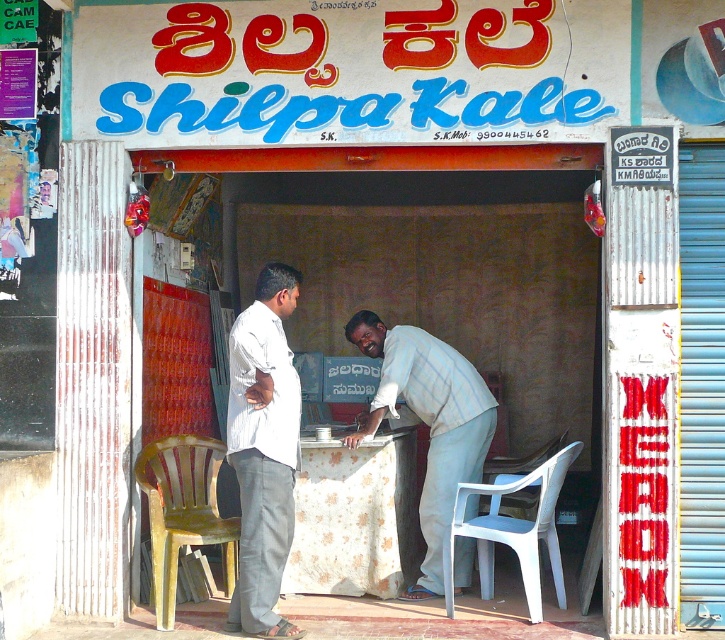
You are standing at the entrance of Shilpa Kale shop and want to reach the counter where the man is leaning over. The counter is located at point (538, 538). There is an obstacle at point (331, 467). Which point should you avoid to reach the counter safely?

You should avoid point (331, 467) because it is closer to you than the counter at point (538, 538), so navigating around it will ensure a safe path to the counter.

You are a customer entering the shop through the right door. You see the floral fabric tablecloth at center and the white plastic chair at lower right. Which object is closer to the entrance?

The white plastic chair at lower right is closer to the entrance because the floral fabric tablecloth at center is above it, indicating it is further back inside the shop.

Based on the photo, you are standing outside the shop entrance and want to place a new table exactly where the floral fabric tablecloth at center is currently located. Based on the coordinates provided, can you determine the exact position to place the table?

The floral fabric tablecloth at center is located at coordinates point (355, 518), so place the table at that exact position.